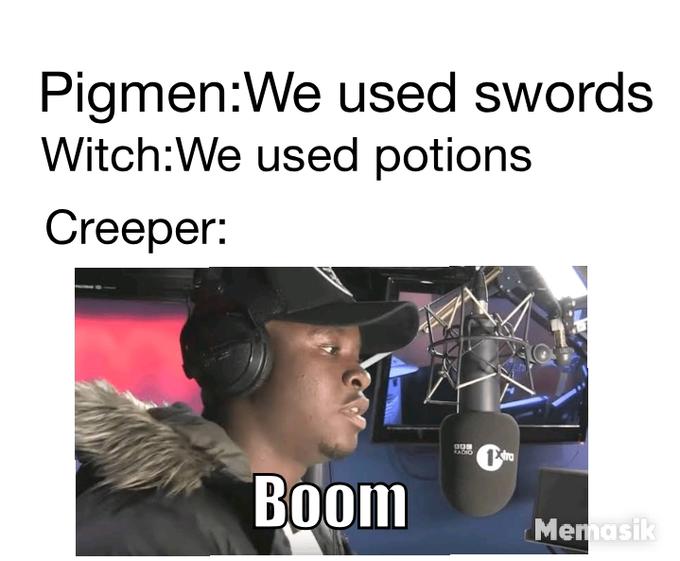
Locate an element on the screen. The height and width of the screenshot is (561, 680). studio is located at coordinates (289, 370).